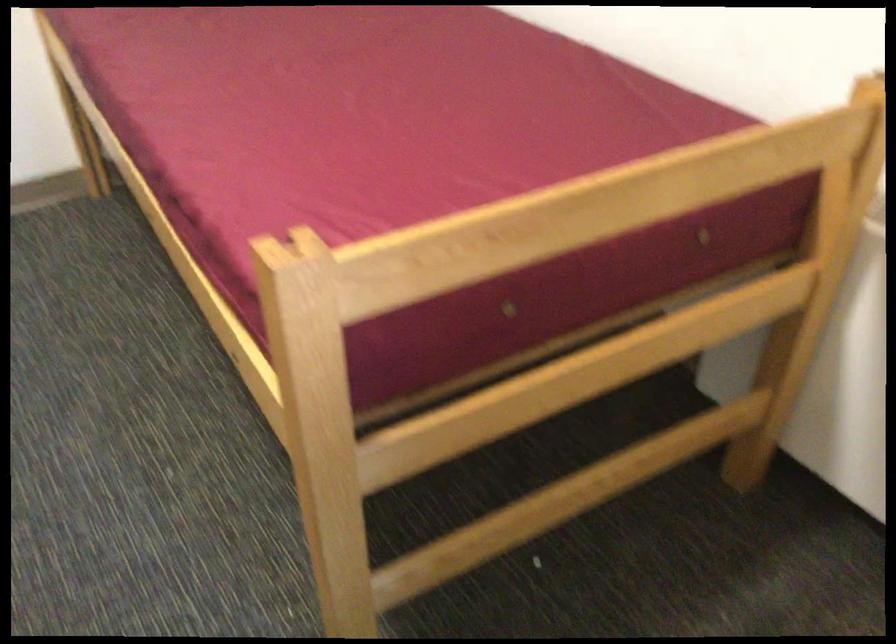
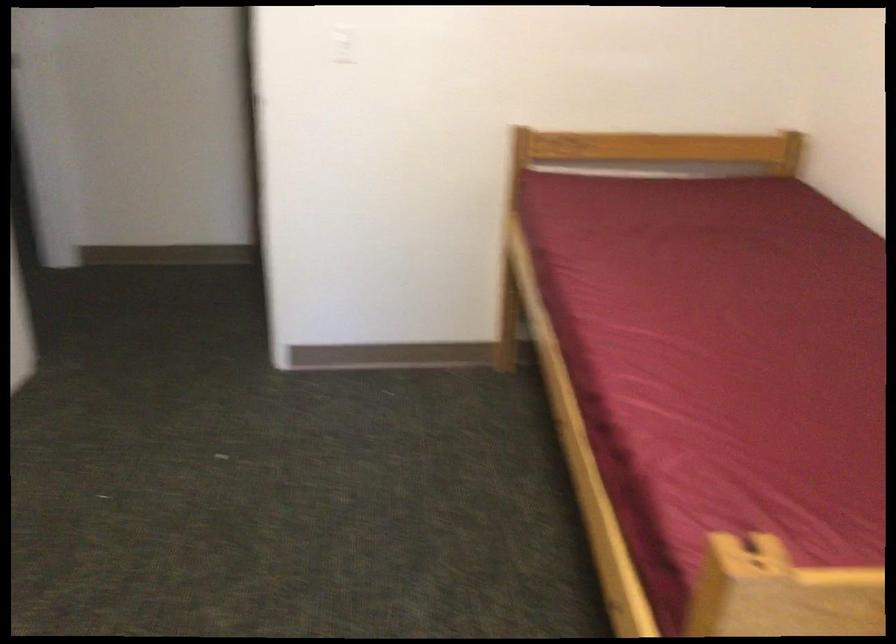
The point at (274, 97) is marked in the first image. Where is the corresponding point in the second image?

(719, 348)